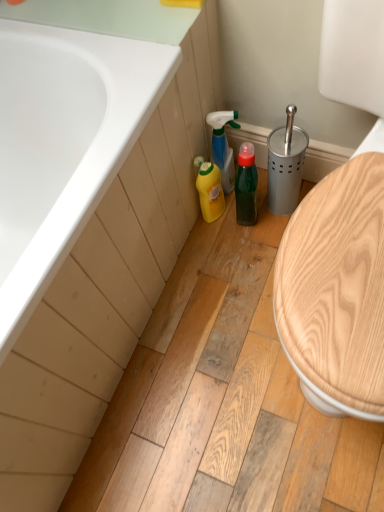
Question: Considering the relative sizes of yellow plastic bottle at lower center, the 2th cleaning product when ordered from top to bottom, and translucent green spray bottle at center, the 2th cleaning product in the bottom-to-top sequence, in the image provided, is yellow plastic bottle at lower center, the 2th cleaning product when ordered from top to bottom, shorter than translucent green spray bottle at center, the 2th cleaning product in the bottom-to-top sequence,?

Choices:
 (A) yes
 (B) no

Answer: (A)

Question: Does yellow plastic bottle at lower center, the 2th cleaning product when ordered from top to bottom, touch translucent green spray bottle at center, the first cleaning product positioned from the top?

Choices:
 (A) yes
 (B) no

Answer: (A)

Question: Considering the relative sizes of yellow plastic bottle at lower center, the 2th cleaning product when ordered from top to bottom, and translucent green spray bottle at center, the 2th cleaning product in the bottom-to-top sequence, in the image provided, is yellow plastic bottle at lower center, the 2th cleaning product when ordered from top to bottom, thinner than translucent green spray bottle at center, the 2th cleaning product in the bottom-to-top sequence,?

Choices:
 (A) no
 (B) yes

Answer: (B)

Question: From the image's perspective, is yellow plastic bottle at lower center, the 2th cleaning product when ordered from top to bottom, below translucent green spray bottle at center, the first cleaning product positioned from the top?

Choices:
 (A) yes
 (B) no

Answer: (A)

Question: From a real-world perspective, is yellow plastic bottle at lower center, the 1th cleaning product from the bottom, on translucent green spray bottle at center, the first cleaning product positioned from the top?

Choices:
 (A) no
 (B) yes

Answer: (A)

Question: Is translucent green spray bottle at center, the 2th cleaning product in the bottom-to-top sequence, at the back of yellow plastic bottle at lower center, the 2th cleaning product when ordered from top to bottom?

Choices:
 (A) yes
 (B) no

Answer: (A)

Question: Considering the relative sizes of green matte bottle at center and yellow plastic bottle at lower center, the 1th cleaning product from the bottom, in the image provided, is green matte bottle at center wider than yellow plastic bottle at lower center, the 1th cleaning product from the bottom,?

Choices:
 (A) no
 (B) yes

Answer: (B)

Question: Is green matte bottle at center at the left side of yellow plastic bottle at lower center, the 1th cleaning product from the bottom?

Choices:
 (A) yes
 (B) no

Answer: (B)

Question: From a real-world perspective, is green matte bottle at center located beneath yellow plastic bottle at lower center, the 2th cleaning product when ordered from top to bottom?

Choices:
 (A) yes
 (B) no

Answer: (B)

Question: Considering the relative sizes of green matte bottle at center and yellow plastic bottle at lower center, the 1th cleaning product from the bottom, in the image provided, is green matte bottle at center shorter than yellow plastic bottle at lower center, the 1th cleaning product from the bottom,?

Choices:
 (A) no
 (B) yes

Answer: (A)

Question: Can you confirm if green matte bottle at center is bigger than yellow plastic bottle at lower center, the 1th cleaning product from the bottom?

Choices:
 (A) no
 (B) yes

Answer: (B)

Question: Is green matte bottle at center turned away from yellow plastic bottle at lower center, the 1th cleaning product from the bottom?

Choices:
 (A) yes
 (B) no

Answer: (B)

Question: Is white glossy bathtub at upper left far from green matte bottle at center?

Choices:
 (A) yes
 (B) no

Answer: (B)